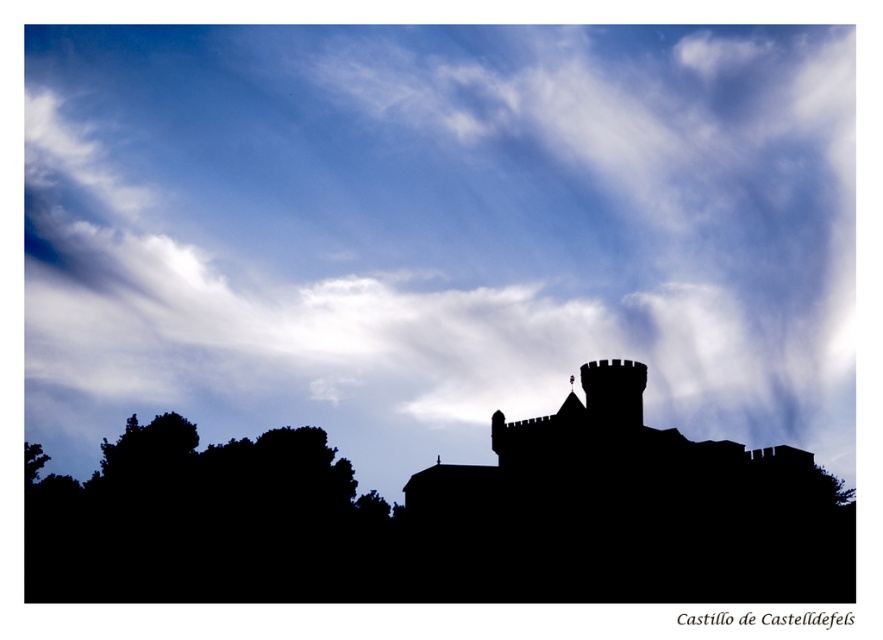
Question: Which point appears closest to the camera in this image?

Choices:
 (A) (205, 67)
 (B) (615, 468)

Answer: (B)

Question: Which of the following is the farthest from the observer?

Choices:
 (A) (612, 561)
 (B) (187, 488)
 (C) (92, 440)

Answer: (C)

Question: Considering the relative positions of silhouette stone castle at center and black leafy tree at lower left in the image provided, where is silhouette stone castle at center located with respect to black leafy tree at lower left?

Choices:
 (A) below
 (B) above

Answer: (B)

Question: Is silhouette stone castle at center thinner than black leafy tree at lower left?

Choices:
 (A) no
 (B) yes

Answer: (B)

Question: Which object appears closest to the camera in this image?

Choices:
 (A) white fluffy cloud at upper center
 (B) black leafy tree at lower left

Answer: (A)

Question: Can you confirm if silhouette stone castle at center is positioned below black leafy tree at lower left?

Choices:
 (A) no
 (B) yes

Answer: (A)